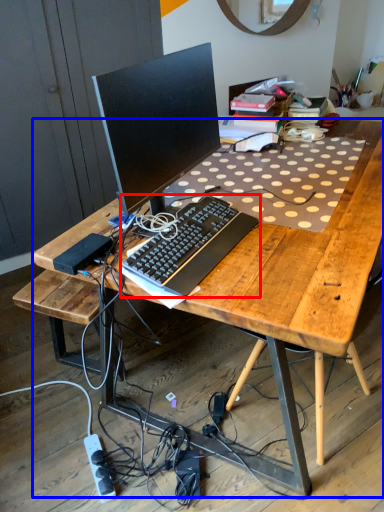
Question: Which object is further to the camera taking this photo, computer keyboard (highlighted by a red box) or desk (highlighted by a blue box)?

Choices:
 (A) computer keyboard
 (B) desk

Answer: (A)